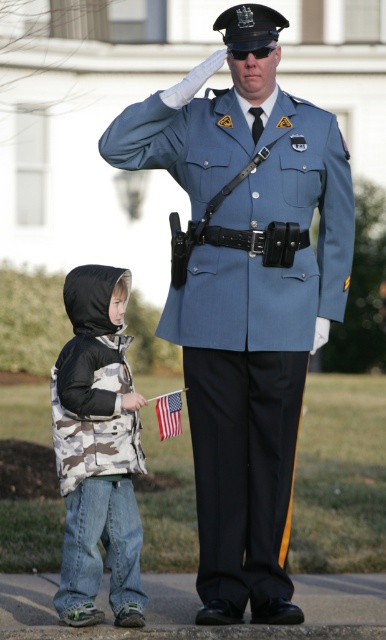
Does blue uniform at center have a lesser width compared to american flag at lower center?

Incorrect, blue uniform at center's width is not less than american flag at lower center's.

Does blue uniform at center lie in front of american flag at lower center?

Yes, blue uniform at center is in front of american flag at lower center.

Who is more forward, (216, 68) or (172, 396)?

Point (172, 396) is in front.

Locate an element on the screen. blue uniform at center is located at coordinates (245, 294).

Is point (275, 244) behind point (66, 602)?

Yes, it is.

Who is positioned more to the left, blue uniform at center or camouflage fabric vest at lower left?

From the viewer's perspective, camouflage fabric vest at lower left appears more on the left side.

Who is more distant from viewer, [243,460] or [91,307]?

The point [243,460] is more distant.

The height and width of the screenshot is (640, 386). What are the coordinates of `blue uniform at center` in the screenshot? It's located at (245, 294).

Who is positioned more to the left, camouflage fabric vest at lower left or american flag at lower center?

camouflage fabric vest at lower left is more to the left.

Does camouflage fabric vest at lower left appear on the right side of american flag at lower center?

In fact, camouflage fabric vest at lower left is to the left of american flag at lower center.

Which is in front, point (72, 492) or point (174, 406)?

Point (72, 492)

You are a GUI agent. You are given a task and a screenshot of the screen. Output one action in this format:
    pyautogui.click(x=<x>, y=<y>)
    Task: Click on the camouflage fabric vest at lower left
    Image resolution: width=386 pixels, height=640 pixels.
    Given the screenshot: What is the action you would take?
    pyautogui.click(x=98, y=449)